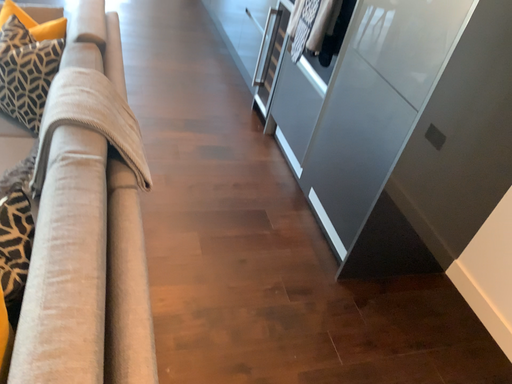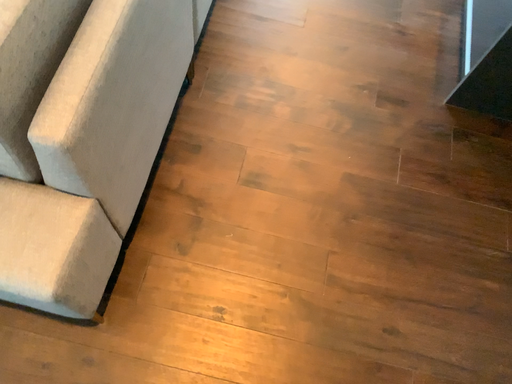
Question: How did the camera likely rotate when shooting the video?

Choices:
 (A) rotated right
 (B) rotated left

Answer: (B)